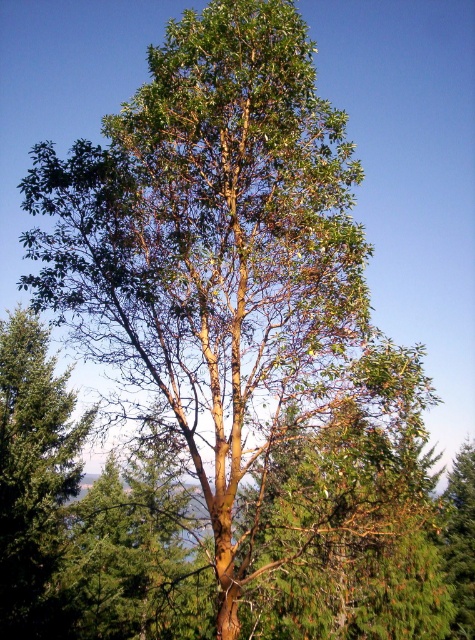
Question: Does green matte tree at left appear on the right side of green matte tree at center?

Choices:
 (A) yes
 (B) no

Answer: (B)

Question: Is green matte tree at left to the right of green matte tree at center from the viewer's perspective?

Choices:
 (A) yes
 (B) no

Answer: (B)

Question: Which point is farther from the camera taking this photo?

Choices:
 (A) (35, 552)
 (B) (465, 467)

Answer: (B)

Question: Is green matte tree at left wider than green matte tree at center?

Choices:
 (A) no
 (B) yes

Answer: (A)

Question: Which of the following is the farthest from the observer?

Choices:
 (A) (10, 422)
 (B) (456, 596)

Answer: (B)

Question: Which object appears closest to the camera in this image?

Choices:
 (A) green matte tree at center
 (B) green matte tree at left

Answer: (A)